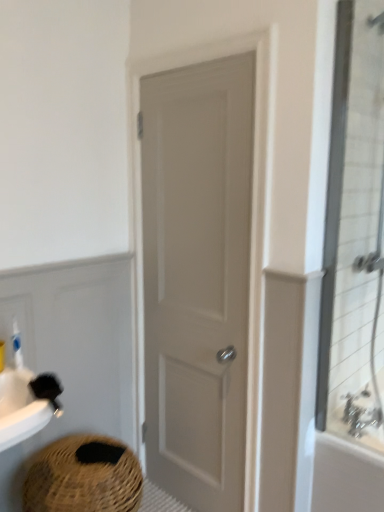
Describe the element at coordinates (17, 345) in the screenshot. I see `white plastic bottle at left` at that location.

At what (x,y) coordinates should I click in order to perform the action: click on white plastic bottle at left. Please return your answer as a coordinate pair (x, y). Image resolution: width=384 pixels, height=512 pixels. Looking at the image, I should click on (17, 345).

Identify the location of white matte door at center. The height and width of the screenshot is (512, 384). (197, 277).

In order to face braided straw basket at lower left, should I rotate leftwards or rightwards?

Turn left approximately 13.530 degrees to face it.

What is the approximate height of silver metallic faucet at upper right?

The height of silver metallic faucet at upper right is 4.41 inches.

Find the location of a particular element. The height and width of the screenshot is (512, 384). white plastic bottle at left is located at coordinates (17, 345).

Are silver metallic faucet at upper right and braided straw basket at lower left beside each other?

silver metallic faucet at upper right and braided straw basket at lower left are clearly separated.

Is silver metallic faucet at upper right oriented towards braided straw basket at lower left?

No, silver metallic faucet at upper right is not facing towards braided straw basket at lower left.

Which of these two, silver metallic faucet at upper right or braided straw basket at lower left, is bigger?

With larger size is braided straw basket at lower left.

Find the location of a particular element. toiletry lying behind the clear glass shower door at right is located at coordinates (17, 345).

Does clear glass shower door at right have a lesser width compared to white plastic bottle at left?

No.

Does point (375, 245) appear closer or farther from the camera than point (19, 342)?

Point (375, 245) is positioned farther from the camera compared to point (19, 342).

Is clear glass shower door at right next to white plastic bottle at left?

No, clear glass shower door at right is not next to white plastic bottle at left.

Considering the relative sizes of silver metallic faucet at upper right and white matte door at center in the image provided, is silver metallic faucet at upper right taller than white matte door at center?

No, silver metallic faucet at upper right is not taller than white matte door at center.

From the picture: Is white matte door at center surrounded by silver metallic faucet at upper right?

That's incorrect, white matte door at center is not inside silver metallic faucet at upper right.

Considering the relative sizes of silver metallic faucet at upper right and white matte door at center in the image provided, is silver metallic faucet at upper right thinner than white matte door at center?

Yes, silver metallic faucet at upper right is thinner than white matte door at center.

How much distance is there between silver metallic faucet at upper right and white matte door at center?

A distance of 32.48 inches exists between silver metallic faucet at upper right and white matte door at center.

Considering the relative positions of white matte door at center and silver metallic faucet at upper right in the image provided, is white matte door at center to the left of silver metallic faucet at upper right from the viewer's perspective?

Indeed, white matte door at center is positioned on the left side of silver metallic faucet at upper right.

Choose the correct answer: Is white matte door at center inside silver metallic faucet at upper right or outside it?

white matte door at center is located beyond the bounds of silver metallic faucet at upper right.

Are white matte door at center and white plastic bottle at left far apart?

They are positioned close to each other.

Consider the image. Which object is wider, white matte door at center or white plastic bottle at left?

With larger width is white matte door at center.

Between point (144, 423) and point (19, 343), which one is positioned behind?

Point (144, 423)

Is silver metallic faucet at upper right to the left or to the right of white plastic bottle at left in the image?

From the image, it's evident that silver metallic faucet at upper right is to the right of white plastic bottle at left.

Considering the relative sizes of silver metallic faucet at upper right and white plastic bottle at left in the image provided, is silver metallic faucet at upper right bigger than white plastic bottle at left?

Indeed, silver metallic faucet at upper right has a larger size compared to white plastic bottle at left.

From the picture: Which object is thinner, silver metallic faucet at upper right or white plastic bottle at left?

With smaller width is white plastic bottle at left.

Is white matte door at center situated inside silver metallic faucet at upper right or outside?

white matte door at center is located beyond the bounds of silver metallic faucet at upper right.

Is white matte door at center oriented away from silver metallic faucet at upper right?

No, silver metallic faucet at upper right is not at the back of white matte door at center.

From a real-world perspective, who is located higher, white matte door at center or silver metallic faucet at upper right?

white matte door at center is physically above.

Does white matte door at center have a greater height compared to silver metallic faucet at upper right?

Correct, white matte door at center is much taller as silver metallic faucet at upper right.

This screenshot has height=512, width=384. In the image, there is a silver metallic faucet at upper right. Find the location of `basket below it (from a real-world perspective)`. basket below it (from a real-world perspective) is located at coordinates (84, 477).

Find the location of a particular element. Image resolution: width=384 pixels, height=512 pixels. toiletry below the clear glass shower door at right (from the image's perspective) is located at coordinates (17, 345).

Estimate the real-world distances between objects in this image. Which object is closer to silver metallic faucet at upper right, braided straw basket at lower left or silver metallic faucet at upper right?

silver metallic faucet at upper right lies closer to silver metallic faucet at upper right than the other object.

From the image, which object appears to be nearer to silver metallic faucet at upper right, braided straw basket at lower left or clear glass shower door at right?

clear glass shower door at right is positioned closer to the anchor silver metallic faucet at upper right.

Looking at the image, which one is located further to silver metallic faucet at upper right, silver metallic faucet at upper right or braided straw basket at lower left?

braided straw basket at lower left.

From the picture: From the image, which object appears to be farther from white matte door at center, silver metallic faucet at upper right or clear glass shower door at right?

Based on the image, silver metallic faucet at upper right appears to be further to white matte door at center.

Based on their spatial positions, is white matte door at center or silver metallic faucet at upper right further from braided straw basket at lower left?

silver metallic faucet at upper right lies further to braided straw basket at lower left than the other object.

Estimate the real-world distances between objects in this image. Which object is closer to braided straw basket at lower left, white plastic bottle at left or clear glass shower door at right?

The object closer to braided straw basket at lower left is white plastic bottle at left.

Based on their spatial positions, is silver metallic faucet at upper right or clear glass shower door at right closer to silver metallic faucet at upper right?

Among the two, silver metallic faucet at upper right is located nearer to silver metallic faucet at upper right.

Which object lies further to the anchor point white matte door at center, clear glass shower door at right or silver metallic faucet at upper right?

silver metallic faucet at upper right lies further to white matte door at center than the other object.

Locate an element on the screen. The image size is (384, 512). door between white plastic bottle at left and silver metallic faucet at upper right in the horizontal direction is located at coordinates (197, 277).

Find the location of `mirror between braided straw basket at lower left and silver metallic faucet at upper right in the horizontal direction`. mirror between braided straw basket at lower left and silver metallic faucet at upper right in the horizontal direction is located at coordinates (354, 230).

This screenshot has height=512, width=384. In order to click on tap situated between white plastic bottle at left and silver metallic faucet at upper right from left to right in this screenshot , I will do `click(361, 413)`.

Where is `mirror between white plastic bottle at left and silver metallic faucet at upper right from left to right`? This screenshot has height=512, width=384. mirror between white plastic bottle at left and silver metallic faucet at upper right from left to right is located at coordinates (354, 230).